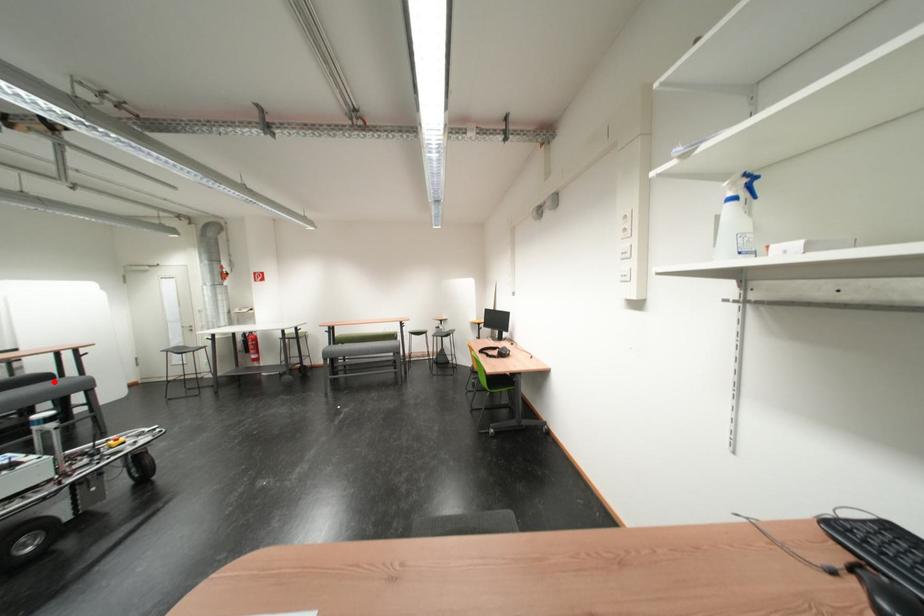
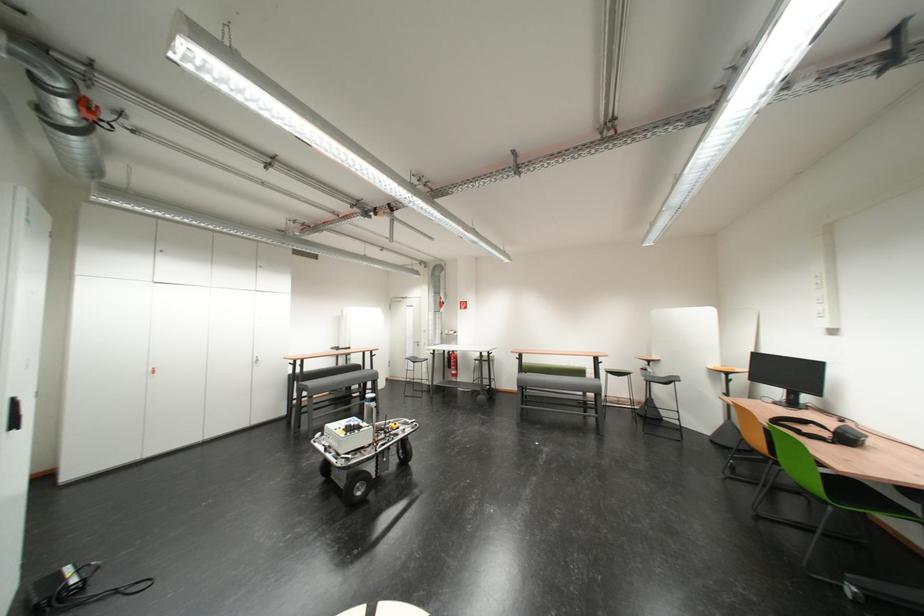
Question: I am providing you with two images of the same scene from different viewpoints. A red point is shown in image1. For the corresponding object point in image2, is it positioned nearer or farther from the camera?

Choices:
 (A) Nearer
 (B) Farther

Answer: (A)